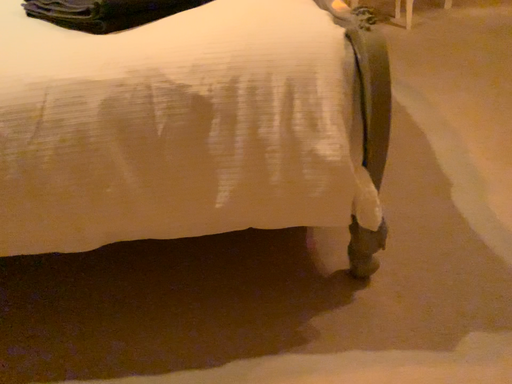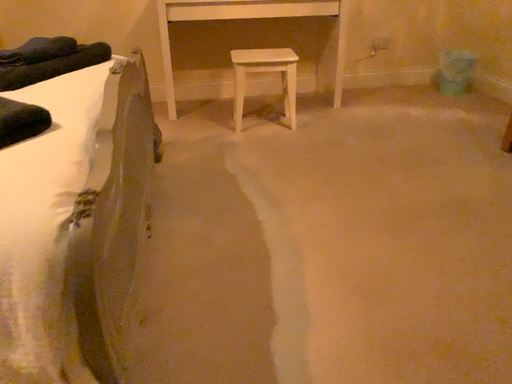
Question: Which way did the camera rotate in the video?

Choices:
 (A) rotated upward
 (B) rotated downward

Answer: (A)